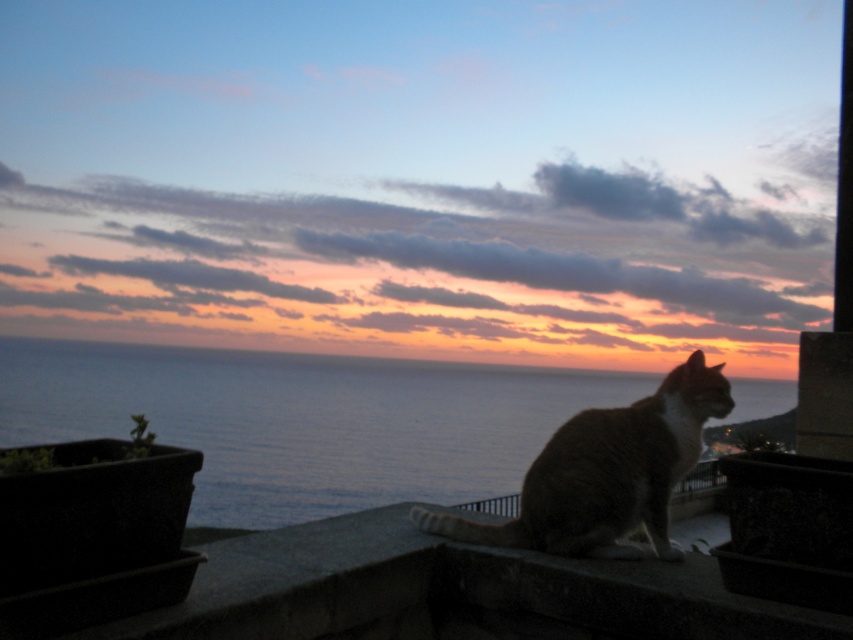
Question: Is blue water at lower left smaller than smooth concrete ledge at center?

Choices:
 (A) no
 (B) yes

Answer: (B)

Question: Which of the following is the farthest from the observer?

Choices:
 (A) blue water at lower left
 (B) smooth concrete ledge at center
 (C) tabby fur cat at center

Answer: (A)

Question: Is the position of smooth concrete ledge at center more distant than that of tabby fur cat at center?

Choices:
 (A) no
 (B) yes

Answer: (A)

Question: Which object is farther from the camera taking this photo?

Choices:
 (A) tabby fur cat at center
 (B) blue water at lower left

Answer: (B)

Question: Which object is the closest to the smooth concrete ledge at center?

Choices:
 (A) blue water at lower left
 (B) tabby fur cat at center

Answer: (B)

Question: Is the position of blue water at lower left less distant than that of tabby fur cat at center?

Choices:
 (A) yes
 (B) no

Answer: (B)